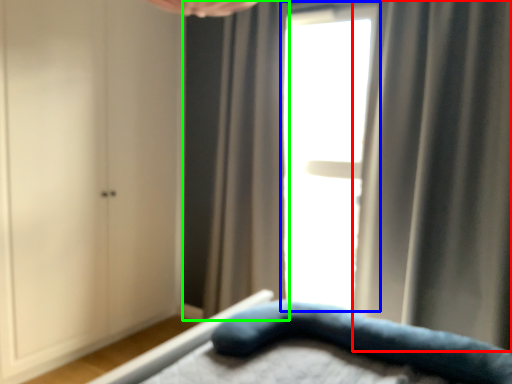
Question: Which object is positioned closest to curtain (highlighted by a red box)? Select from window (highlighted by a blue box) and curtain (highlighted by a green box).

Choices:
 (A) window
 (B) curtain

Answer: (A)